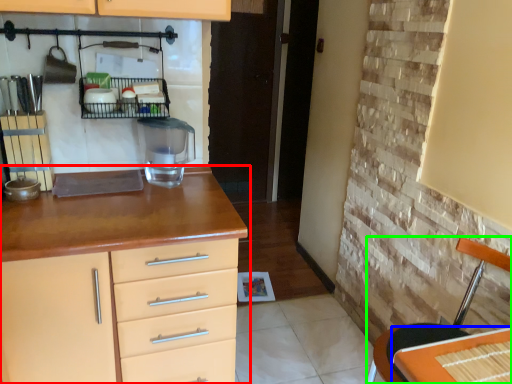
Question: Which object is the farthest from chest of drawers (highlighted by a red box)? Choose among these: table (highlighted by a blue box) or chair (highlighted by a green box).

Choices:
 (A) table
 (B) chair

Answer: (A)